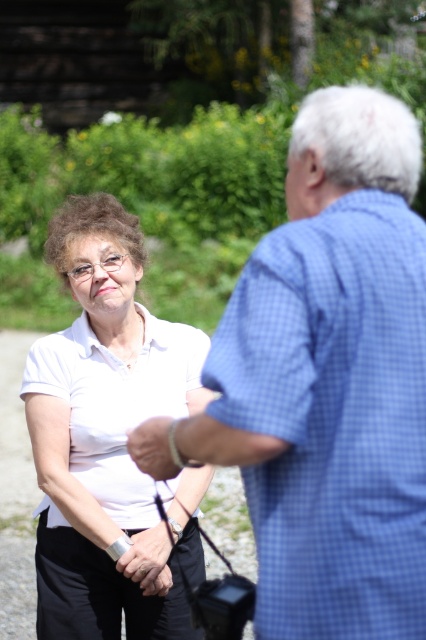
Measure the distance between matte black hand at center and smooth skin hand at center.

matte black hand at center and smooth skin hand at center are 38.67 inches apart.

Who is lower down, matte black hand at center or smooth skin hand at center?

matte black hand at center is lower down.

You are a GUI agent. You are given a task and a screenshot of the screen. Output one action in this format:
    pyautogui.click(x=<x>, y=<y>)
    Task: Click on the matte black hand at center
    This screenshot has height=640, width=426.
    Given the screenshot: What is the action you would take?
    pyautogui.click(x=147, y=561)

In the scene shown: Is white matte shirt at center to the right of smooth skin hand at center from the viewer's perspective?

No, white matte shirt at center is not to the right of smooth skin hand at center.

Can you confirm if white matte shirt at center is bigger than smooth skin hand at center?

Yes, white matte shirt at center is bigger than smooth skin hand at center.

I want to click on white matte shirt at center, so click(x=103, y=428).

Does blue checkered shirt at upper right appear under white matte shirt at center?

Incorrect, blue checkered shirt at upper right is not positioned below white matte shirt at center.

Is blue checkered shirt at upper right taller than white matte shirt at center?

Incorrect, blue checkered shirt at upper right's height is not larger of white matte shirt at center's.

Which is behind, point (336, 476) or point (134, 326)?

The point (134, 326) is behind.

The height and width of the screenshot is (640, 426). I want to click on blue checkered shirt at upper right, so click(x=331, y=380).